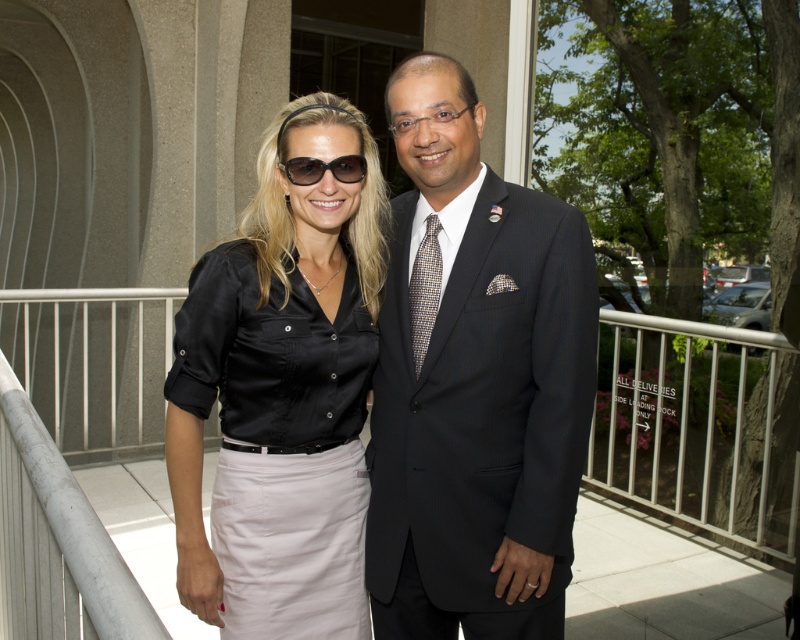
You are a photographer trying to capture a photo of the two people in the scene. You want to ensure that the satin black blouse at center and the multicolored woven tie at center are both visible in the frame. Based on their positions, which one should you focus on first to ensure both are in the frame?

The satin black blouse at center is to the left of the multicolored woven tie at center, so you should focus on the multicolored woven tie at center first to ensure both are in the frame.

You are a photographer trying to capture a clear shot of both the satin black blouse at center and the multicolored woven tie at center. Based on their positions, which one might be partially hidden in the photo?

The multicolored woven tie at center might be partially hidden because the satin black blouse at center is in front of it.

You are a photographer setting up for a group photo. You need to ensure that both the satin black blouse at center and the man in the dark pinstripe suit are in frame. Given the current distance between them, will you need to adjust your camera lens to a wider angle to capture both subjects comfortably?

The distance between the satin black blouse at center and the man in the dark pinstripe suit is 5.40 feet. Depending on the camera sensor size and focal length, a wider angle lens may be necessary to include both subjects in the frame without cropping.